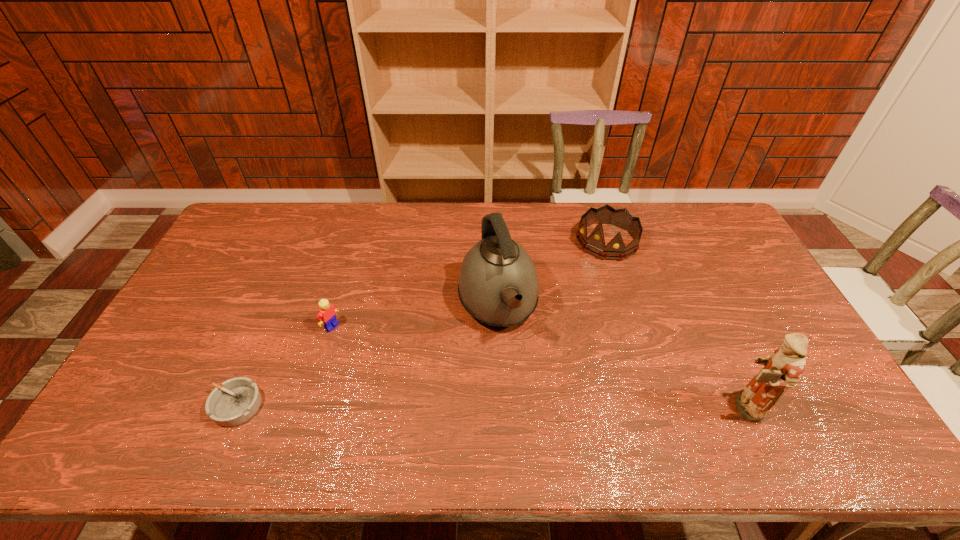
The height and width of the screenshot is (540, 960). Find the location of `vacant space located on the front-facing side of the rightmost object`. vacant space located on the front-facing side of the rightmost object is located at coordinates (653, 407).

Image resolution: width=960 pixels, height=540 pixels. Identify the location of vacant space located on the front-facing side of the rightmost object. (653, 407).

I want to click on vacant area situated 0.060m at the spout of the third object from left to right, so click(516, 366).

Identify the location of vacant space situated 0.150m at the spout of the third object from left to right. This screenshot has width=960, height=540. (525, 395).

I want to click on vacant space situated at the spout of the third object from left to right, so click(528, 405).

Locate an element on the screen. This screenshot has height=540, width=960. vacant region located on the front-facing side of the second shortest object is located at coordinates (401, 373).

Where is `vacant space situated 0.240m on the front-facing side of the second shortest object`? This screenshot has height=540, width=960. vacant space situated 0.240m on the front-facing side of the second shortest object is located at coordinates (398, 371).

Image resolution: width=960 pixels, height=540 pixels. What are the coordinates of `free space located 0.210m on the front-facing side of the second shortest object` in the screenshot? It's located at pyautogui.click(x=390, y=366).

The width and height of the screenshot is (960, 540). In order to click on free region located at the front of the third shortest object with jewels in this screenshot , I will do (555, 296).

Where is `free space located 0.160m at the front of the third shortest object with jewels`? This screenshot has width=960, height=540. free space located 0.160m at the front of the third shortest object with jewels is located at coordinates [567, 284].